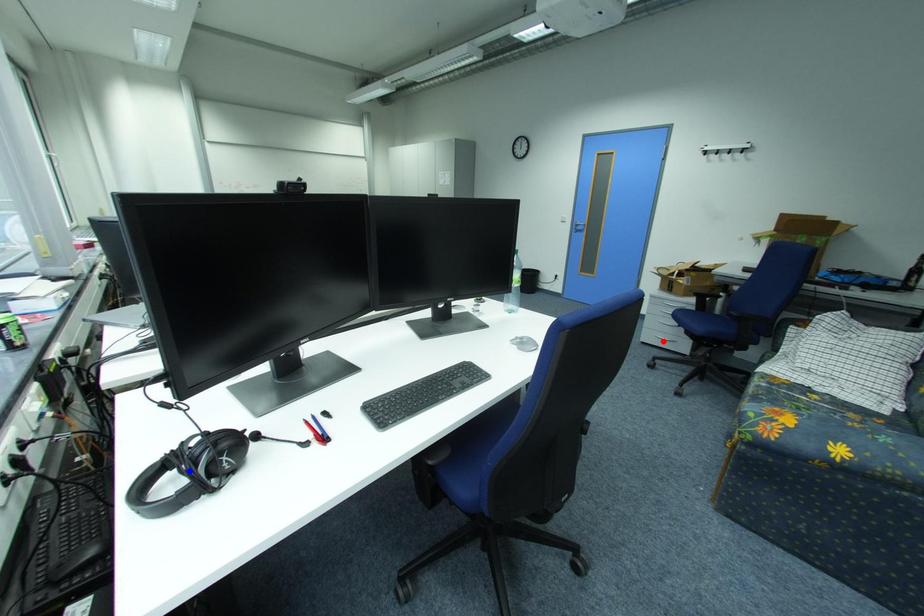
Question: In the image, two points are highlighted. Which point is nearer to the camera? Reply with the corresponding letter.

Choices:
 (A) blue point
 (B) red point

Answer: (A)